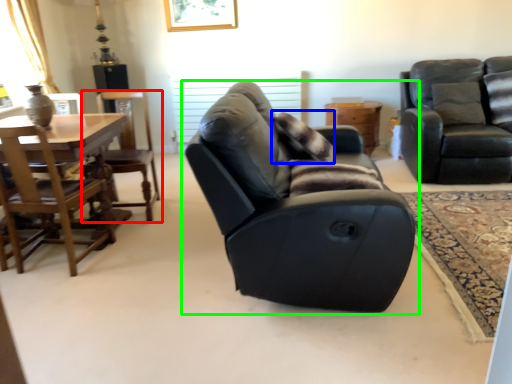
Question: Which object is positioned farthest from chair (highlighted by a red box)? Select from pillow (highlighted by a blue box) and chair (highlighted by a green box).

Choices:
 (A) pillow
 (B) chair

Answer: (B)